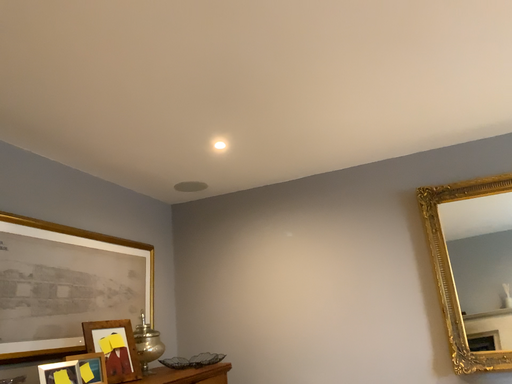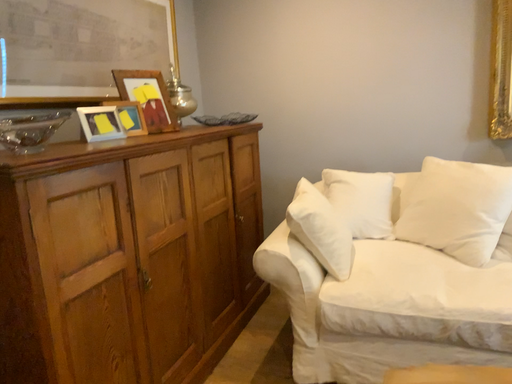
Question: How did the camera likely rotate when shooting the video?

Choices:
 (A) rotated upward
 (B) rotated downward

Answer: (B)